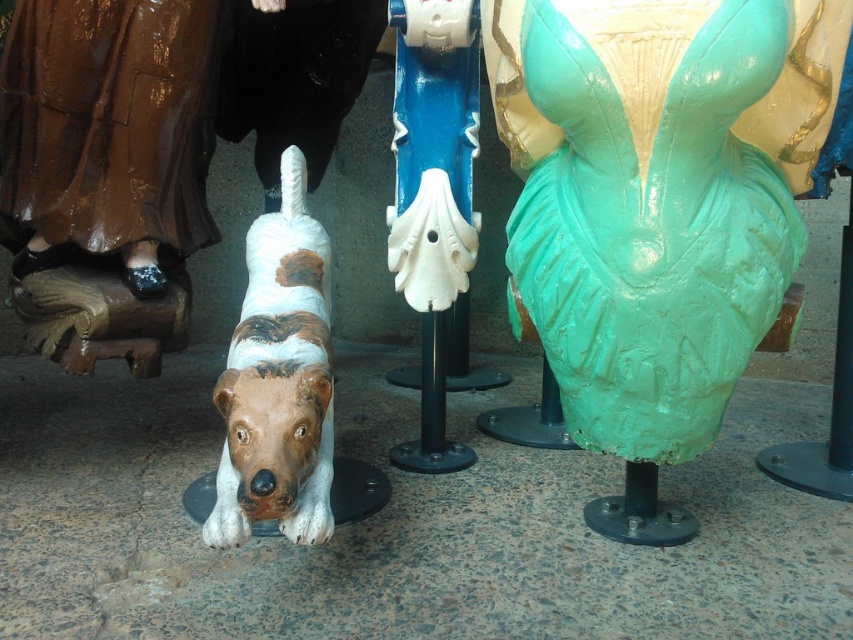
You are standing at the center of the art exhibit and want to locate the speckled ceramic dog at lower left. According to the coordinates provided, in which direction should you move to find it?

The speckled ceramic dog at lower left is located at coordinates point (277, 380), so you should move to the lower left direction from the center to find it.

You are an art curator trying to arrange these sculptures in a way that emphasizes their size contrast. Given that you have the speckled ceramic dog at lower left and the white glossy pole at center, which sculpture should be placed in a position to draw attention to its larger size?

The speckled ceramic dog at lower left should be placed in a position to draw attention to its larger size since it is bigger than the white glossy pole at center.